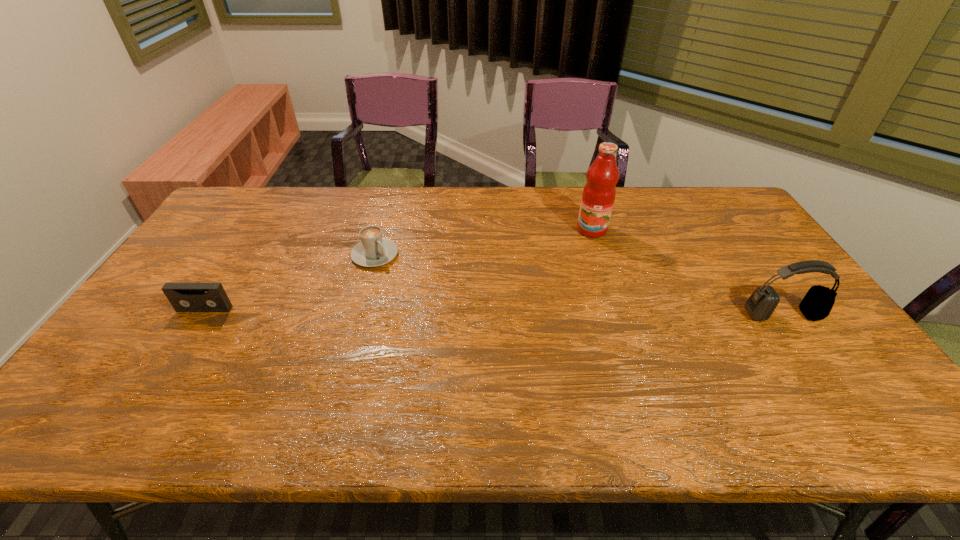
This screenshot has width=960, height=540. I want to click on free space between the second object from right to left and the videotape, so click(x=398, y=269).

Locate an element on the screen. vacant area that lies between the videotape and the headset is located at coordinates (493, 312).

Locate an element on the screen. blank region between the cappuccino and the leftmost object is located at coordinates pos(290,282).

Identify which object is located as the nearest to the third nearest object. Please provide its 2D coordinates. Your answer should be formatted as a tuple, i.e. [(x, y)], where the tuple contains the x and y coordinates of a point satisfying the conditions above.

[(184, 297)]

Locate which object ranks third in proximity to the rightmost object. Please provide its 2D coordinates. Your answer should be formatted as a tuple, i.e. [(x, y)], where the tuple contains the x and y coordinates of a point satisfying the conditions above.

[(184, 297)]